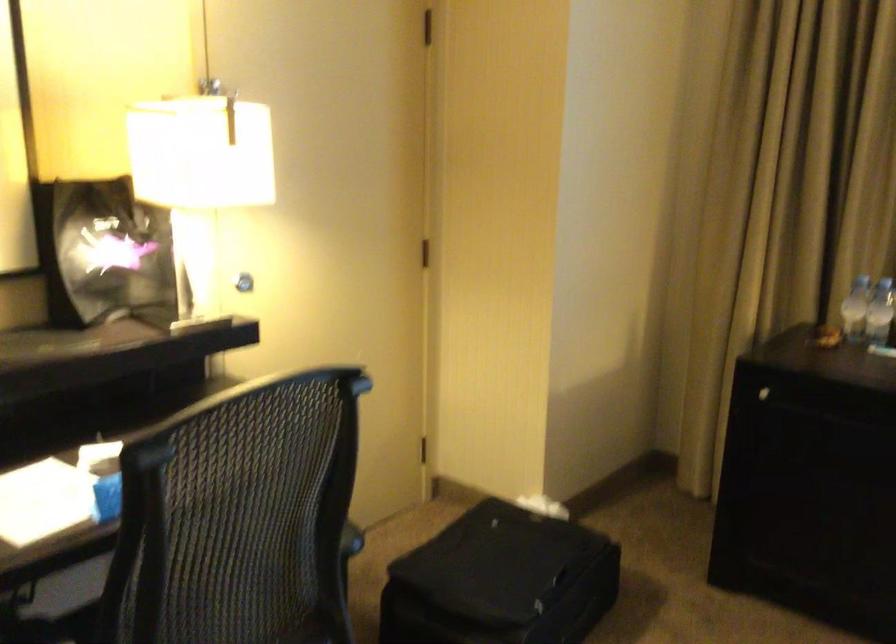
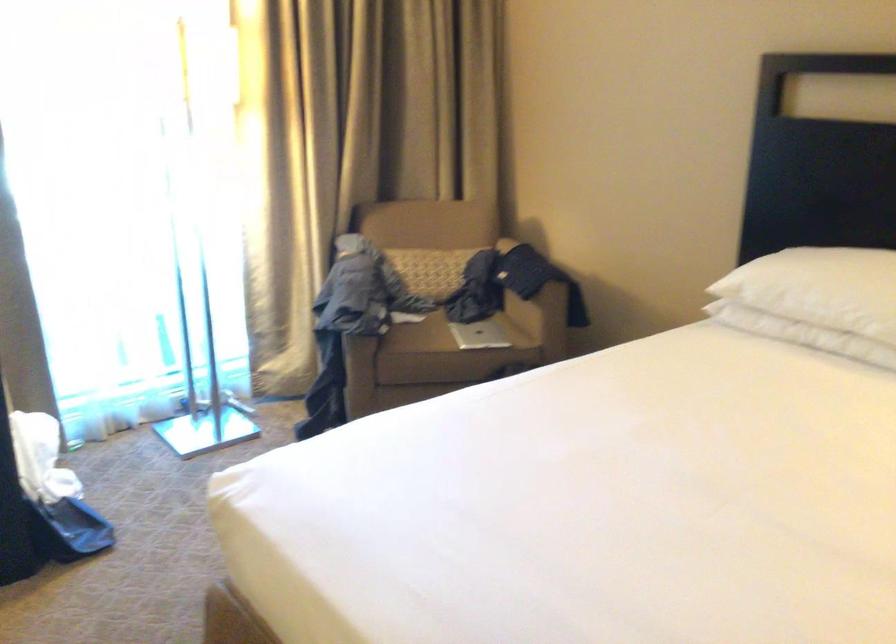
Question: How did the camera likely rotate?

Choices:
 (A) Left
 (B) Right
 (C) Up
 (D) Down

Answer: (B)